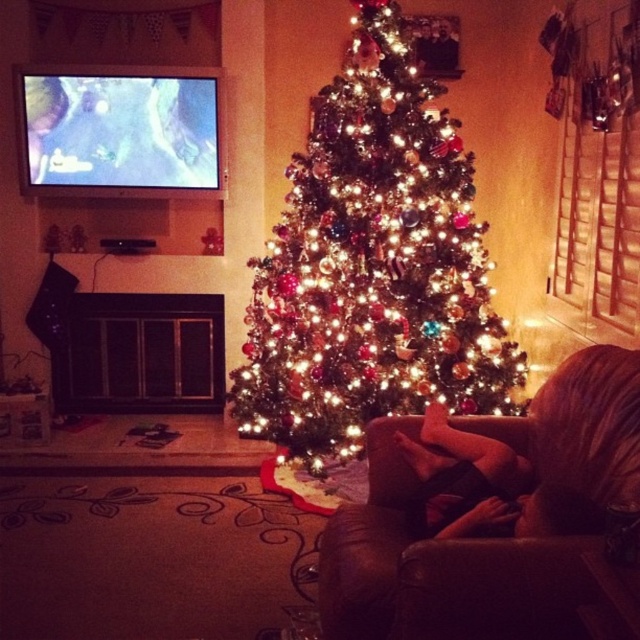
Who is taller, iridescent glass ornaments at center or black leather pants at lower center?

iridescent glass ornaments at center

Is iridescent glass ornaments at center wider than black leather pants at lower center?

Indeed, iridescent glass ornaments at center has a greater width compared to black leather pants at lower center.

Describe the element at coordinates (372, 266) in the screenshot. I see `iridescent glass ornaments at center` at that location.

Locate an element on the screen. The image size is (640, 640). iridescent glass ornaments at center is located at coordinates (372, 266).

Who is positioned more to the left, iridescent glass ornaments at center or brown leather couch at center?

From the viewer's perspective, iridescent glass ornaments at center appears more on the left side.

Can you confirm if iridescent glass ornaments at center is taller than brown leather couch at center?

Indeed, iridescent glass ornaments at center has a greater height compared to brown leather couch at center.

Describe the element at coordinates (372, 266) in the screenshot. I see `iridescent glass ornaments at center` at that location.

Identify the location of iridescent glass ornaments at center. Image resolution: width=640 pixels, height=640 pixels. (372, 266).

Does point (579, 376) lie behind point (467, 529)?

Yes, it is.

Who is higher up, brown leather couch at center or black leather pants at lower center?

brown leather couch at center

Does point (371, 584) lie behind point (497, 454)?

No.

Locate an element on the screen. The image size is (640, 640). brown leather couch at center is located at coordinates (493, 538).